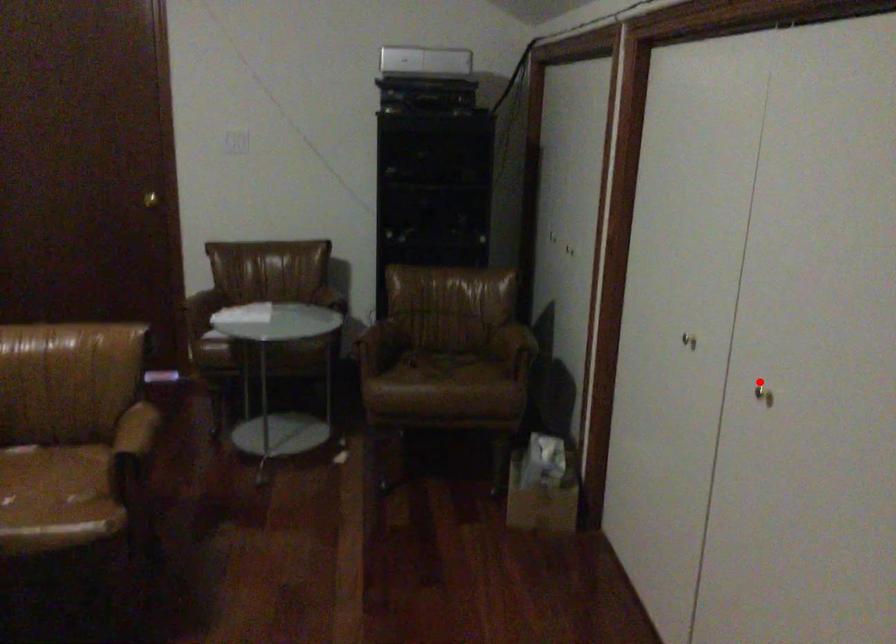
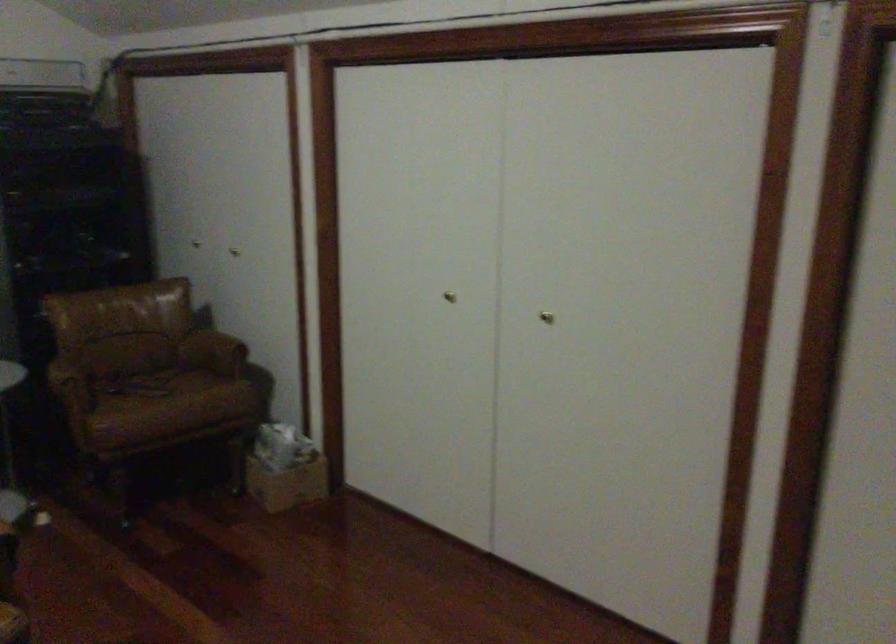
Question: I am providing you with two images of the same scene from different viewpoints. A red point is shown in image1. For the corresponding object point in image2, is it positioned nearer or farther from the camera?

Choices:
 (A) Nearer
 (B) Farther

Answer: (B)